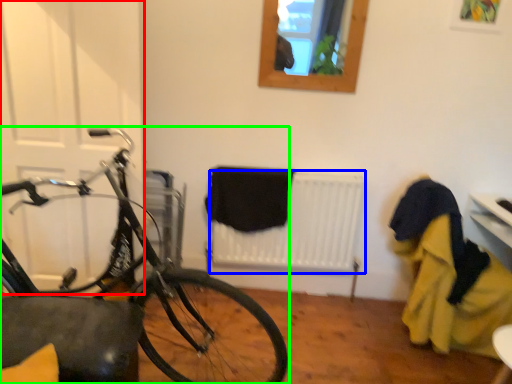
Question: Which object is positioned farthest from door (highlighted by a red box)? Select from radiator (highlighted by a blue box) and bicycle (highlighted by a green box).

Choices:
 (A) radiator
 (B) bicycle

Answer: (A)